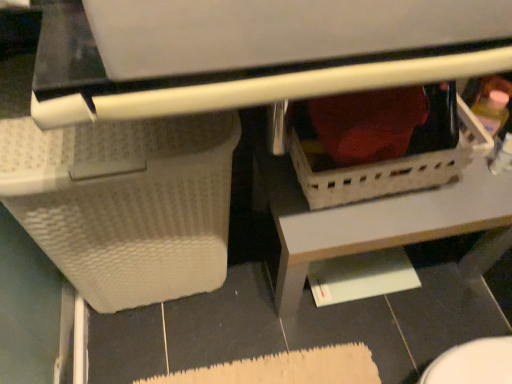
Locate an element on the screen. vacant space that's between white textured basket at lower left, marked as the first basket in a left-to-right arrangement, and white plastic basket at lower center is located at coordinates (234, 281).